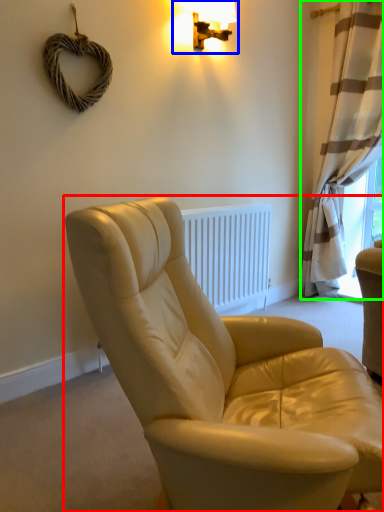
Question: Estimate the real-world distances between objects in this image. Which object is closer to studio couch (highlighted by a red box), lamp (highlighted by a blue box) or curtain (highlighted by a green box)?

Choices:
 (A) lamp
 (B) curtain

Answer: (A)